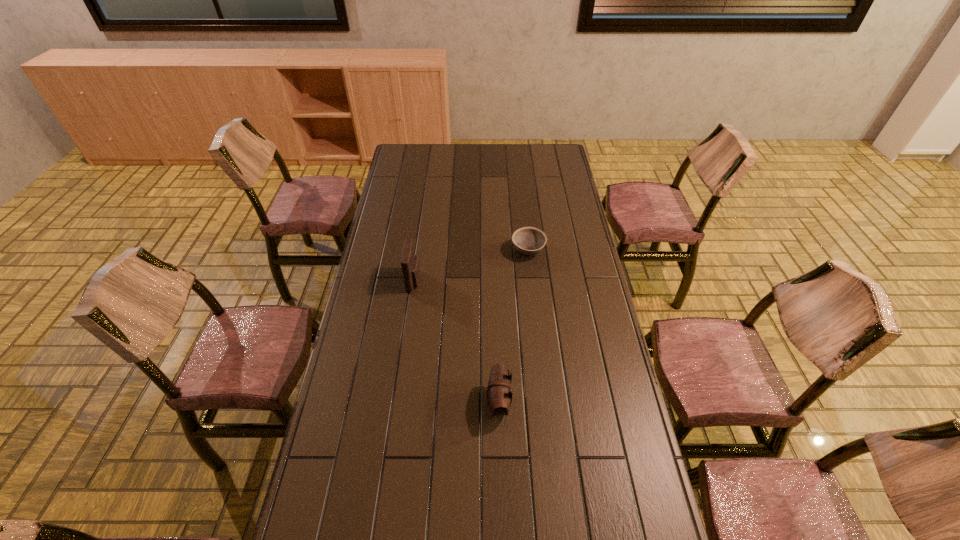
The width and height of the screenshot is (960, 540). Identify the location of the farther pouch. (410, 266).

Locate an element on the screen. This screenshot has height=540, width=960. the leftmost object is located at coordinates (410, 266).

Identify the location of the nearest object. This screenshot has width=960, height=540. (499, 392).

The height and width of the screenshot is (540, 960). I want to click on the second object from right to left, so click(x=499, y=392).

Where is `bowl`? This screenshot has width=960, height=540. bowl is located at coordinates (528, 240).

Where is `the farthest object`? The height and width of the screenshot is (540, 960). the farthest object is located at coordinates (528, 240).

Locate an element on the screen. The image size is (960, 540). vacant area situated with an open flap on the leftmost object is located at coordinates (518, 280).

In order to click on vacant area located with the flap open on the nearer pouch in this screenshot , I will do `click(356, 402)`.

You are a GUI agent. You are given a task and a screenshot of the screen. Output one action in this format:
    pyautogui.click(x=<x>, y=<y>)
    Task: Click on the free region located 0.370m with the flap open on the nearer pouch
    The image size is (960, 540).
    Given the screenshot: What is the action you would take?
    pyautogui.click(x=367, y=402)

At what (x,y) coordinates should I click in order to perform the action: click on free space located 0.120m with the flap open on the nearer pouch. Please return your answer as a coordinate pair (x, y). Looking at the image, I should click on (447, 402).